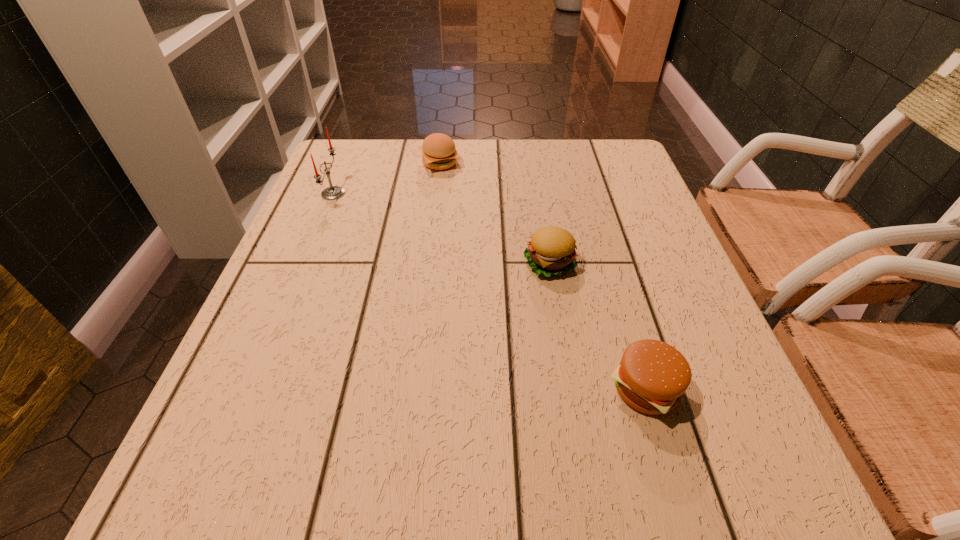
What are the coordinates of `vacant area that satisfies the following two spatial constraints: 1. on the front-facing side of the third nearest object; 2. on the right side of the second farthest hamburger` in the screenshot? It's located at (304, 263).